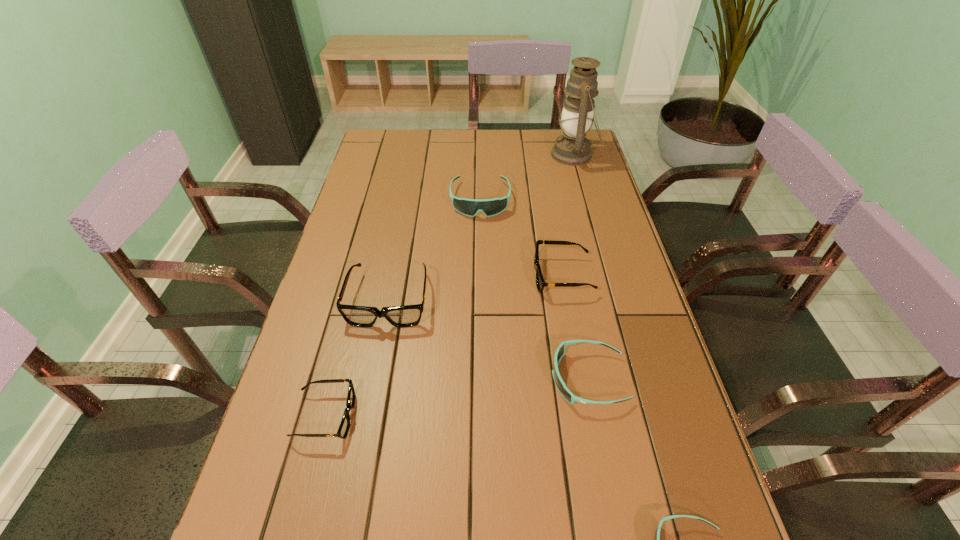
Identify the location of the farthest object. The width and height of the screenshot is (960, 540). (572, 148).

The width and height of the screenshot is (960, 540). Identify the location of oil lamp. (572, 148).

Where is `the biggest black sunglasses`? The width and height of the screenshot is (960, 540). the biggest black sunglasses is located at coordinates (403, 316).

You are a GUI agent. You are given a task and a screenshot of the screen. Output one action in this format:
    pyautogui.click(x=<x>, y=<y>)
    Task: Click on the sixth nearest object
    This screenshot has height=540, width=960.
    Given the screenshot: What is the action you would take?
    pyautogui.click(x=470, y=207)

You are a GUI agent. You are given a task and a screenshot of the screen. Output one action in this format:
    pyautogui.click(x=<x>, y=<y>)
    Task: Click on the leftmost cyan sunglasses
    Image resolution: width=960 pixels, height=540 pixels.
    Given the screenshot: What is the action you would take?
    pyautogui.click(x=470, y=207)

The height and width of the screenshot is (540, 960). What are the coordinates of `the second smallest black sunglasses` in the screenshot? It's located at (540, 283).

Find the location of a particular element. the second biggest cyan sunglasses is located at coordinates coord(564,391).

Where is `the smallest black sunglasses`? The width and height of the screenshot is (960, 540). the smallest black sunglasses is located at coordinates (343, 429).

This screenshot has width=960, height=540. Identify the location of vacant point located 0.340m on the left of the brown oil lamp. (460, 155).

Identify the location of free region located on the front-facing side of the biggest black sunglasses. (372, 389).